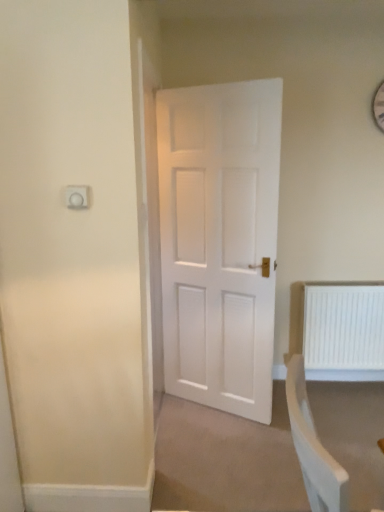
Question: From the image's perspective, is white plastic radiator at lower right beneath white plastic socket at upper left?

Choices:
 (A) yes
 (B) no

Answer: (A)

Question: Is white plastic radiator at lower right touching white plastic socket at upper left?

Choices:
 (A) no
 (B) yes

Answer: (A)

Question: Is white plastic radiator at lower right thinner than white plastic socket at upper left?

Choices:
 (A) yes
 (B) no

Answer: (B)

Question: Is white plastic radiator at lower right wider than white plastic socket at upper left?

Choices:
 (A) no
 (B) yes

Answer: (B)

Question: Could you tell me if white plastic radiator at lower right is turned towards white plastic socket at upper left?

Choices:
 (A) yes
 (B) no

Answer: (B)

Question: Is white plastic radiator at lower right positioned with its back to white plastic socket at upper left?

Choices:
 (A) no
 (B) yes

Answer: (A)

Question: Is white plastic socket at upper left next to white plastic radiator at lower right and touching it?

Choices:
 (A) yes
 (B) no

Answer: (B)

Question: Is white plastic socket at upper left in front of white plastic radiator at lower right?

Choices:
 (A) yes
 (B) no

Answer: (A)

Question: Can you confirm if white plastic socket at upper left is wider than white plastic radiator at lower right?

Choices:
 (A) no
 (B) yes

Answer: (A)

Question: Is white plastic socket at upper left thinner than white plastic radiator at lower right?

Choices:
 (A) no
 (B) yes

Answer: (B)

Question: From a real-world perspective, is white plastic socket at upper left under white plastic radiator at lower right?

Choices:
 (A) yes
 (B) no

Answer: (B)

Question: Does white plastic socket at upper left have a lesser height compared to white plastic radiator at lower right?

Choices:
 (A) yes
 (B) no

Answer: (A)

Question: Do you think white plastic socket at upper left is within white plastic radiator at lower right, or outside of it?

Choices:
 (A) inside
 (B) outside

Answer: (B)